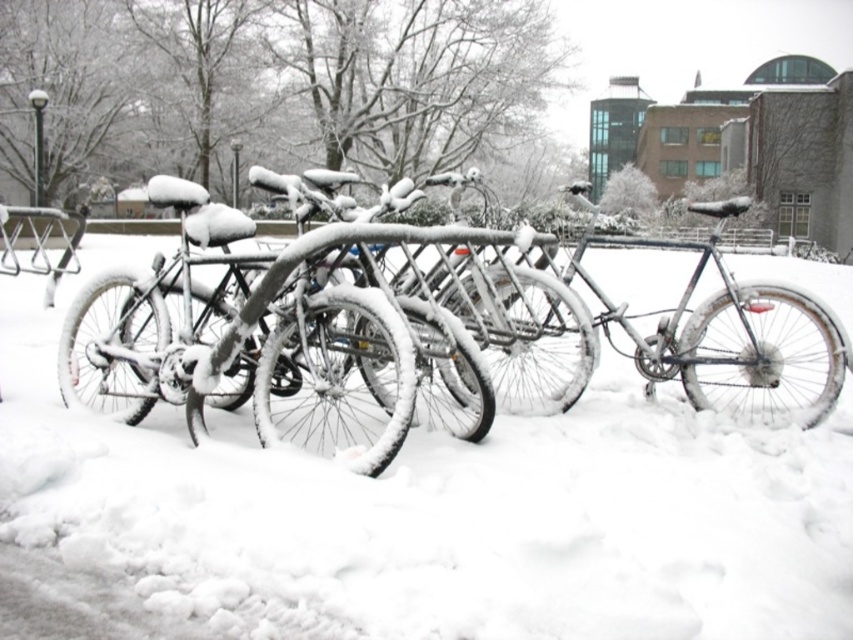
Question: Among these points, which one is farthest from the camera?

Choices:
 (A) (730, 467)
 (B) (718, 253)

Answer: (B)

Question: Does white fluffy snow at center have a smaller size compared to shiny silver bicycle at center?

Choices:
 (A) no
 (B) yes

Answer: (A)

Question: Does white fluffy snow at center appear over shiny silver bicycle at center?

Choices:
 (A) no
 (B) yes

Answer: (B)

Question: Which point is farther to the camera?

Choices:
 (A) white fluffy snow at center
 (B) shiny silver bicycle at center

Answer: (B)

Question: Which of the following is the closest to the observer?

Choices:
 (A) (461, 314)
 (B) (589, 481)

Answer: (B)

Question: Can you confirm if white fluffy snow at center is bigger than shiny silver bicycle at center?

Choices:
 (A) no
 (B) yes

Answer: (B)